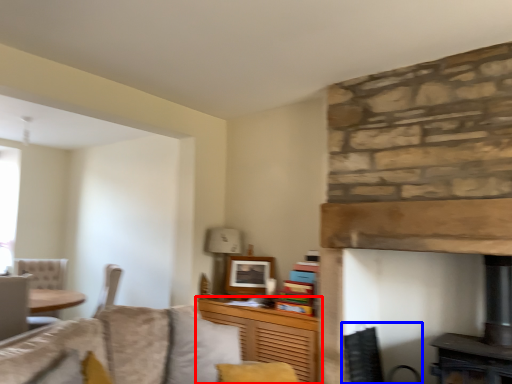
Question: Which of the following is the farthest to the observer, cabinetry (highlighted by a red box) or swivel chair (highlighted by a blue box)?

Choices:
 (A) cabinetry
 (B) swivel chair

Answer: (B)